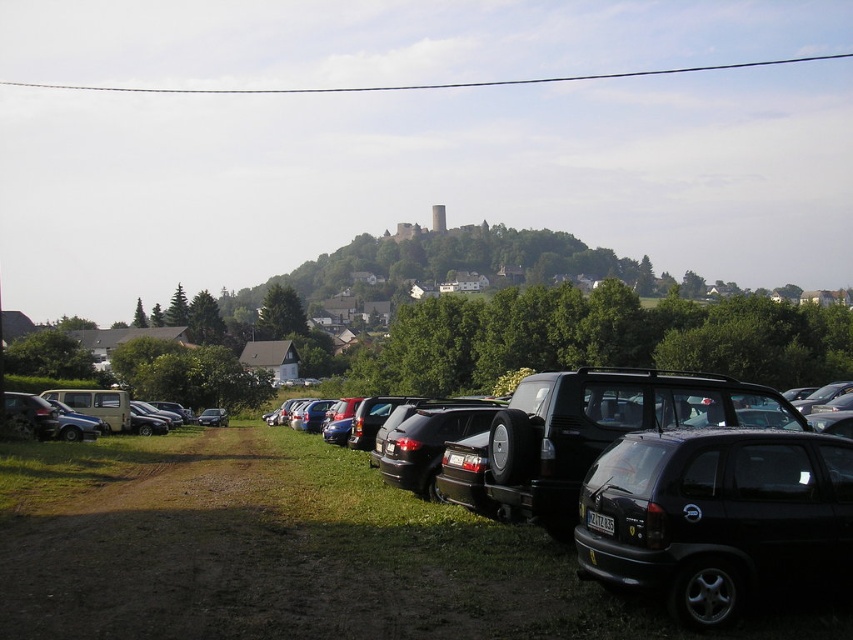
Question: Does shiny black car at center have a smaller size compared to black matte hatchback at lower right?

Choices:
 (A) no
 (B) yes

Answer: (A)

Question: Based on their relative distances, which object is nearer to the black matte hatchback at lower right?

Choices:
 (A) black wire at upper center
 (B) shiny black car at center

Answer: (B)

Question: Where is black matte hatchback at lower right located in relation to black wire at upper center in the image?

Choices:
 (A) above
 (B) below

Answer: (B)

Question: Which object appears closest to the camera in this image?

Choices:
 (A) black matte hatchback at lower right
 (B) shiny black car at center

Answer: (B)

Question: Can you confirm if black matte hatchback at lower right is positioned below black wire at upper center?

Choices:
 (A) no
 (B) yes

Answer: (B)

Question: Estimate the real-world distances between objects in this image. Which object is closer to the black matte hatchback at lower right?

Choices:
 (A) shiny black car at center
 (B) black wire at upper center

Answer: (A)